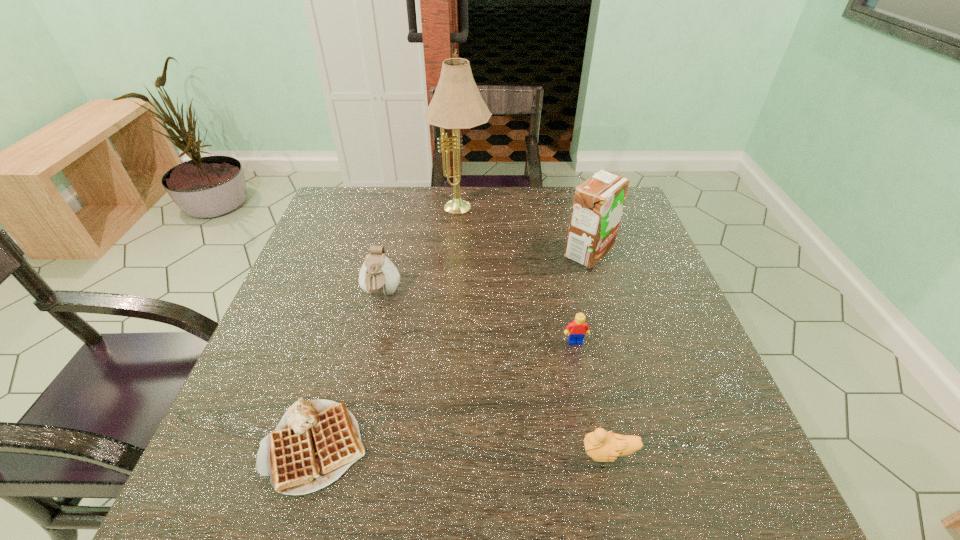
In order to click on duckling that is positioned at the near edge in this screenshot , I will do `click(601, 446)`.

Locate an element on the screen. waffle located in the near edge section of the desktop is located at coordinates (316, 441).

Find the location of a particular element. object at the left edge is located at coordinates (316, 441).

Where is `object situated at the right edge`? The image size is (960, 540). object situated at the right edge is located at coordinates (598, 202).

This screenshot has height=540, width=960. Find the location of `object that is at the near left corner`. object that is at the near left corner is located at coordinates (316, 441).

At what (x,y) coordinates should I click in order to perform the action: click on free space at the far edge of the desktop. Please return your answer as a coordinate pair (x, y). The height and width of the screenshot is (540, 960). Looking at the image, I should click on (513, 190).

Locate an element on the screen. Image resolution: width=960 pixels, height=540 pixels. free location at the left edge of the desktop is located at coordinates (260, 424).

I want to click on vacant area at the right edge, so click(693, 452).

The height and width of the screenshot is (540, 960). What are the coordinates of `vacant space at the far left corner of the desktop` in the screenshot? It's located at (347, 191).

Where is `vacant space that's between the Lego and the fourth shortest object`? Image resolution: width=960 pixels, height=540 pixels. vacant space that's between the Lego and the fourth shortest object is located at coordinates (478, 318).